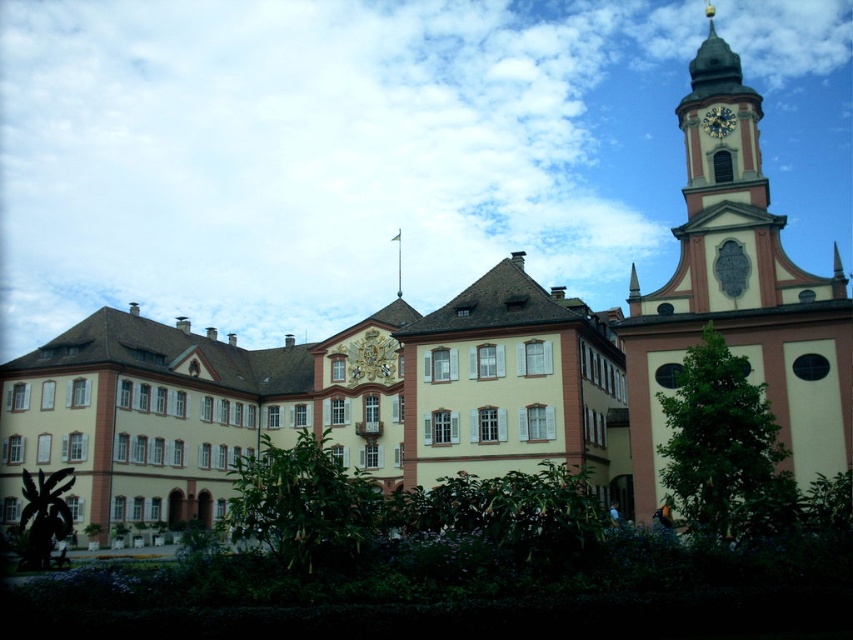
Is beige stone clock tower at upper right to the right of gold metallic clock at upper right from the viewer's perspective?

Correct, you'll find beige stone clock tower at upper right to the right of gold metallic clock at upper right.

Between point (697, 208) and point (706, 124), which one is positioned in front?

Point (697, 208)

In order to click on beige stone clock tower at upper right in this screenshot , I will do `click(738, 296)`.